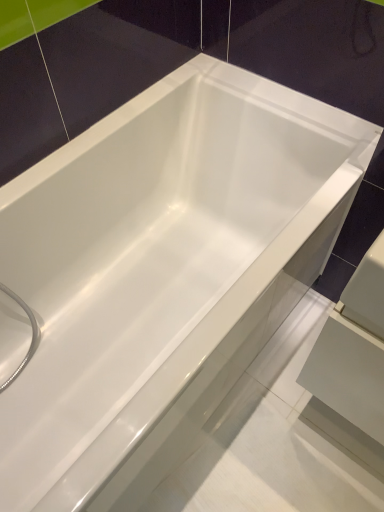
Question: Should I look upward or downward to see satin gray drawer at lower right?

Choices:
 (A) up
 (B) down

Answer: (B)